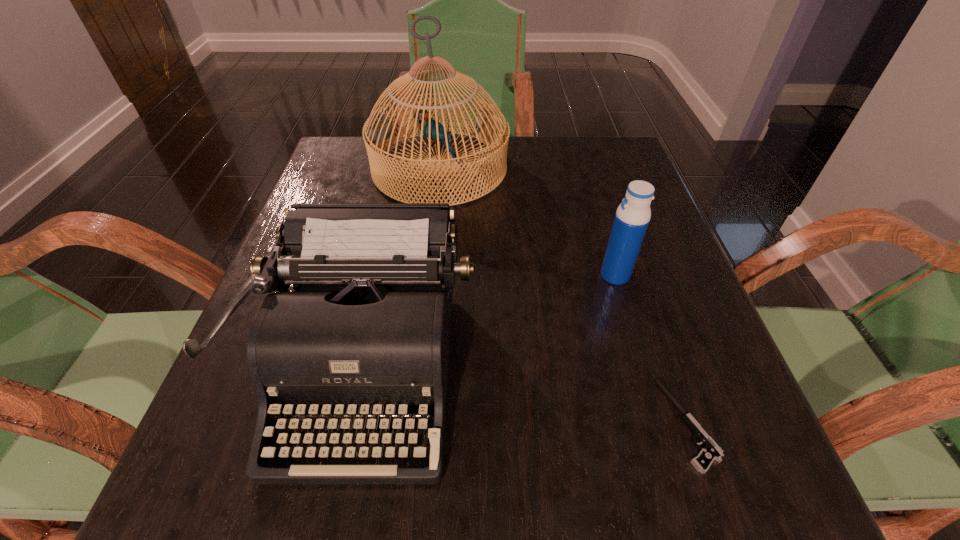
Image resolution: width=960 pixels, height=540 pixels. I want to click on object located at the far edge, so click(x=377, y=128).

Where is `typewriter that is at the near edge`? The image size is (960, 540). typewriter that is at the near edge is located at coordinates (365, 331).

Where is `pistol present at the near edge`? The image size is (960, 540). pistol present at the near edge is located at coordinates (711, 451).

Where is `birdcage present at the left edge`? The height and width of the screenshot is (540, 960). birdcage present at the left edge is located at coordinates (377, 128).

The image size is (960, 540). Find the location of `typewriter located in the left edge section of the desktop`. typewriter located in the left edge section of the desktop is located at coordinates (365, 331).

Locate an element on the screen. The image size is (960, 540). water bottle that is at the right edge is located at coordinates (632, 217).

Find the location of a particular element. This screenshot has width=960, height=540. pistol present at the right edge is located at coordinates (711, 451).

Where is `object present at the far left corner`? object present at the far left corner is located at coordinates (377, 128).

In order to click on object at the near left corner in this screenshot , I will do `click(365, 331)`.

At what (x,y) coordinates should I click in order to perform the action: click on object present at the near right corner. Please return your answer as a coordinate pair (x, y). Looking at the image, I should click on (711, 451).